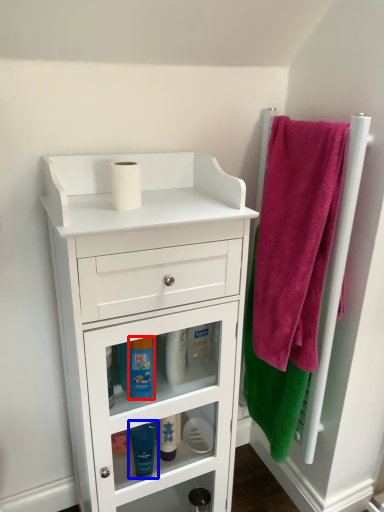
Question: Which point is closer to the camera, mouthwash (highlighted by a red box) or mouthwash (highlighted by a blue box)?

Choices:
 (A) mouthwash
 (B) mouthwash

Answer: (A)